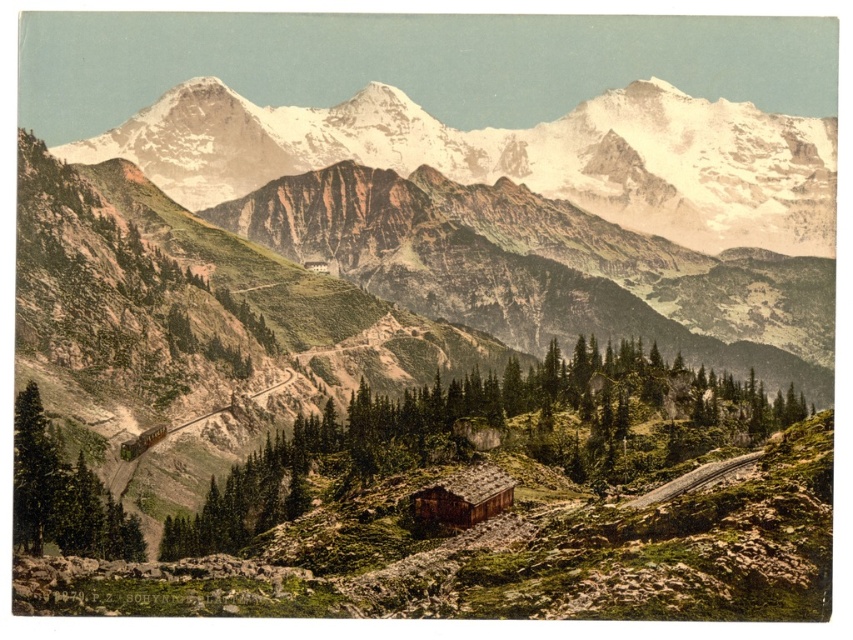
Question: Does snowy granite mountains at upper center have a smaller size compared to green textured log cabin at center?

Choices:
 (A) no
 (B) yes

Answer: (A)

Question: Can you confirm if snowy granite mountains at upper center is positioned below green textured log cabin at center?

Choices:
 (A) no
 (B) yes

Answer: (A)

Question: Which point is closer to the camera taking this photo?

Choices:
 (A) (677, 388)
 (B) (94, 552)
 (C) (630, 193)
 (D) (491, 504)

Answer: (B)

Question: Is snowy granite mountains at upper center thinner than brown wooden cabin at center?

Choices:
 (A) yes
 (B) no

Answer: (B)

Question: Which object is positioned closest to the snowy granite mountains at upper center?

Choices:
 (A) brown wooden cabin at center
 (B) green textured log cabin at center
 (C) green textured tree at lower left

Answer: (B)

Question: Among these objects, which one is nearest to the camera?

Choices:
 (A) brown wooden cabin at center
 (B) green textured log cabin at center
 (C) snowy granite mountains at upper center

Answer: (A)